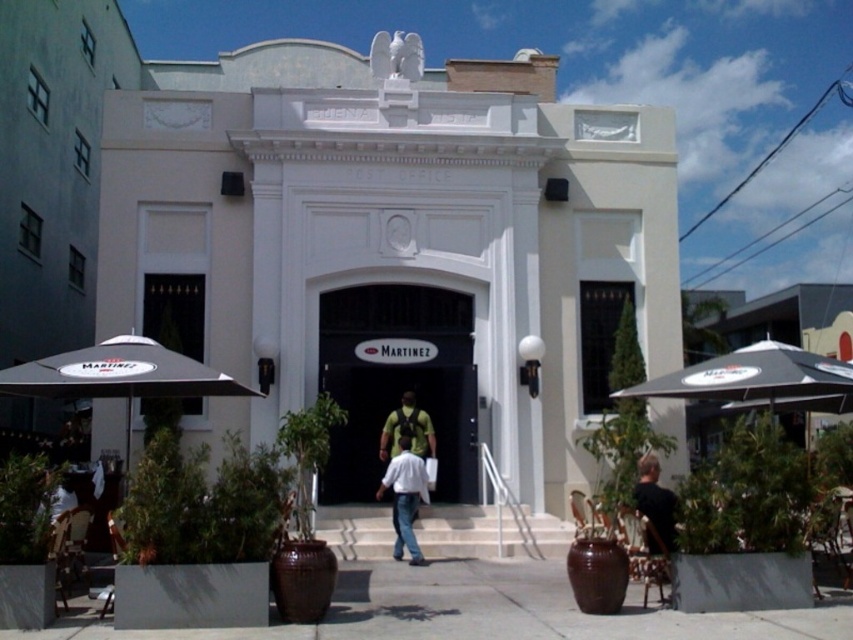
From the picture: You are standing in front of the historic post office building and want to place a new bench between the two points labeled point (466, 627) and point (383, 480). Which point should the bench be closer to if you want it to be nearer to the entrance of the building?

The bench should be closer to point (383, 480) because it is farther from the viewer, meaning it is closer to the entrance of the building.

You are standing at the entrance of the historic post office and see the smooth concrete pavement at center and the white cotton shirt at center. Which object is positioned to the left of the other?

The smooth concrete pavement at center is to the left of the white cotton shirt at center.